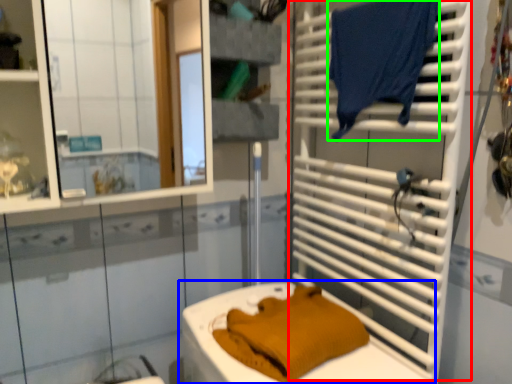
Question: Which is farther away from shutter (highlighted by a red box)? toilet (highlighted by a blue box) or laundry (highlighted by a green box)?

Choices:
 (A) toilet
 (B) laundry

Answer: (A)